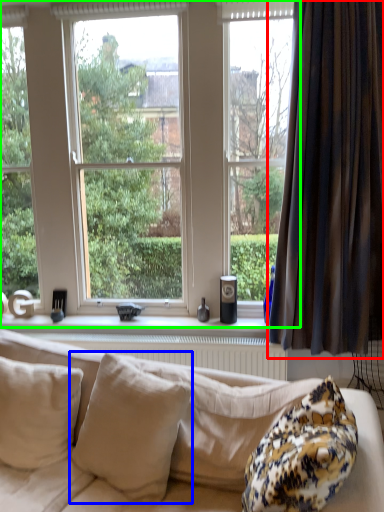
Question: Which object is the closest to the curtain (highlighted by a red box)? Choose among these: pillow (highlighted by a blue box) or window (highlighted by a green box).

Choices:
 (A) pillow
 (B) window

Answer: (B)